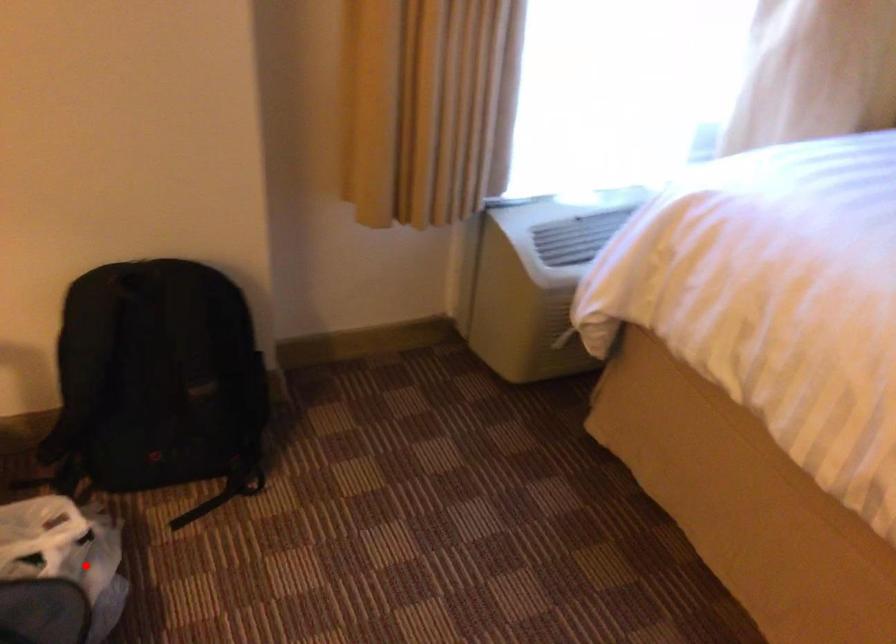
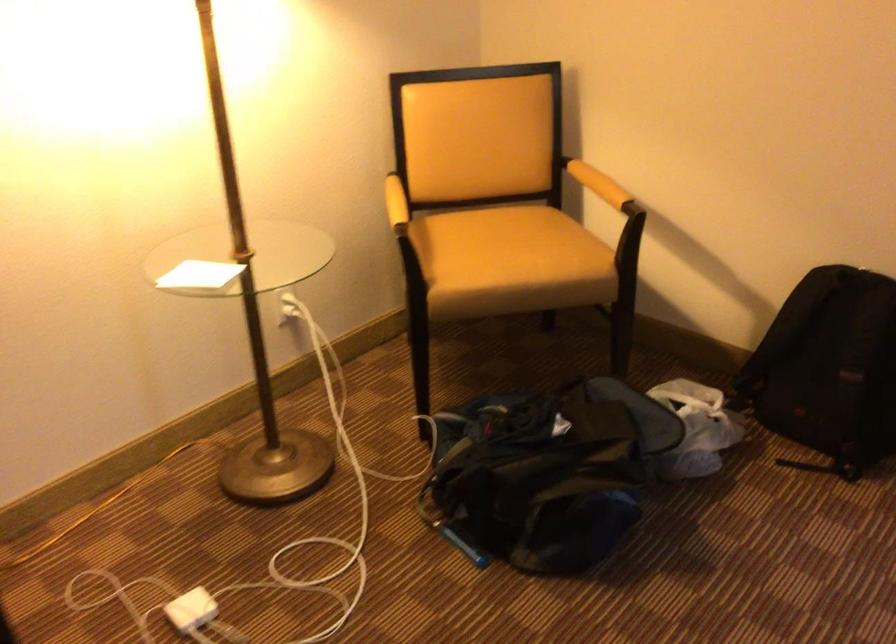
Question: I am providing you with two images of the same scene from different viewpoints. A red point is marked on the first image. Can you still see the location of the red point in image 2?

Choices:
 (A) Yes
 (B) No

Answer: (A)